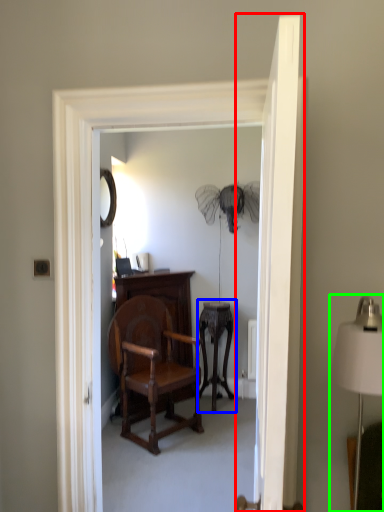
Question: Considering the real-world distances, which object is closest to door (highlighted by a red box)? side table (highlighted by a blue box) or table lamp (highlighted by a green box).

Choices:
 (A) side table
 (B) table lamp

Answer: (B)